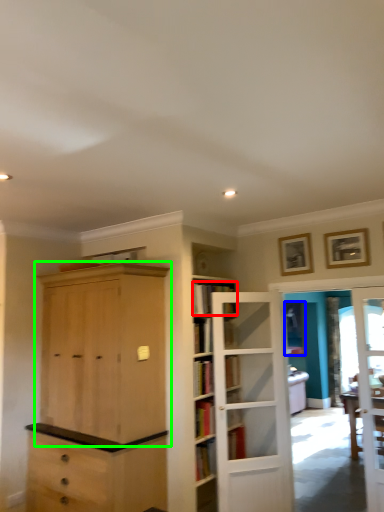
Question: Which object is positioned closest to book (highlighted by a red box)? Select from window (highlighted by a blue box) and cabinetry (highlighted by a green box).

Choices:
 (A) window
 (B) cabinetry

Answer: (B)